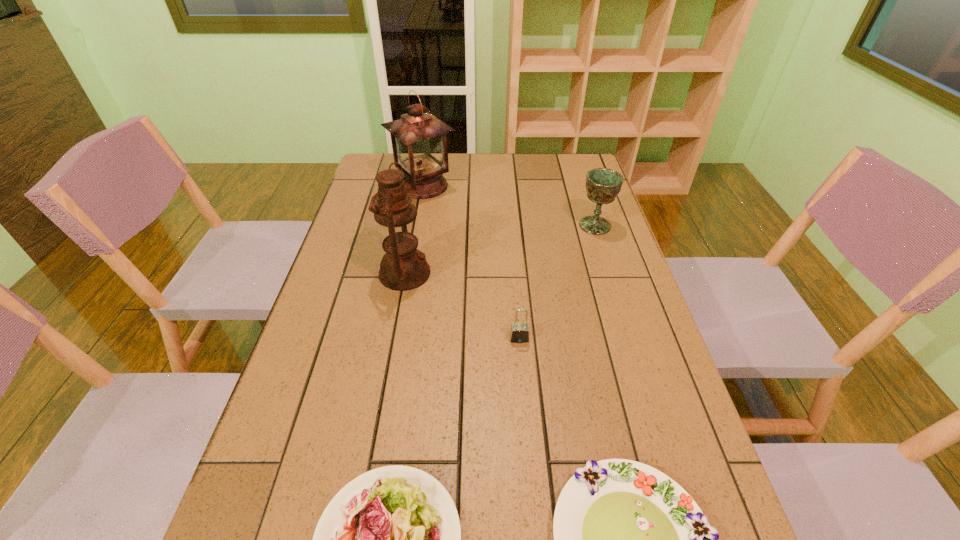
The image size is (960, 540). Find the location of `object present at the far edge`. object present at the far edge is located at coordinates (419, 139).

Identify the location of object that is at the right edge. The image size is (960, 540). (603, 185).

Identify the location of object located at the far left corner. This screenshot has height=540, width=960. (419, 139).

Where is `vacant space at the far edge of the desktop`? Image resolution: width=960 pixels, height=540 pixels. vacant space at the far edge of the desktop is located at coordinates (549, 183).

This screenshot has width=960, height=540. In the image, there is a desktop. Identify the location of vacant space at the left edge. (343, 300).

Locate an element on the screen. Image resolution: width=960 pixels, height=540 pixels. free space at the right edge of the desktop is located at coordinates (599, 268).

Image resolution: width=960 pixels, height=540 pixels. In the image, there is a desktop. What are the coordinates of `free region at the far left corner` in the screenshot? It's located at (376, 155).

Identify the location of free space at the far right corner of the desktop. (566, 168).

You are a GUI agent. You are given a task and a screenshot of the screen. Output one action in this format:
    pyautogui.click(x=<x>, y=<y>)
    Task: Click on the free space between the fourth object from left to right and the nearer oil lamp
    This screenshot has height=540, width=960.
    Given the screenshot: What is the action you would take?
    click(462, 306)

You are a GUI agent. You are given a task and a screenshot of the screen. Output one action in this format:
    pyautogui.click(x=<x>, y=<y>)
    Task: Click on the unoccupied area between the farther oil lamp and the padlock
    This screenshot has height=540, width=960.
    Given the screenshot: What is the action you would take?
    click(471, 262)